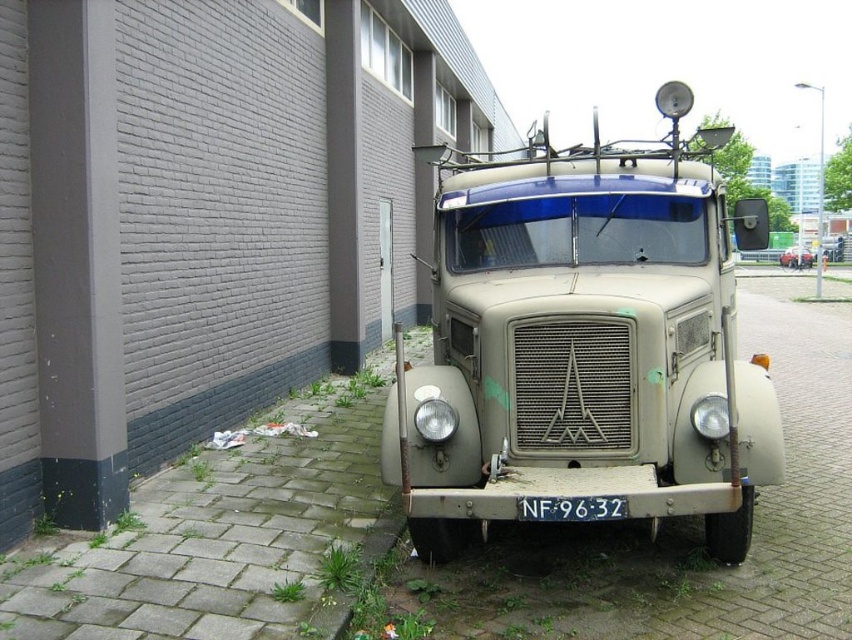
You are a delivery driver who needs to check the license plate of the matte beige truck at center. However, you notice that the black plastic license plate at center is obstructed. Based on the scene, can you determine if the license plate is visible from your current position in front of the truck?

The black plastic license plate at center is behind matte beige truck at center, so it is not visible from the front position.

You are standing at the origin point of a coordinate system where the image is mapped. The truck is at coordinates given. If you want to walk directly to the matte beige truck at center, in which direction should you move from your current position?

You should move towards the coordinates specified for the matte beige truck at center, which is located at point 0.536 on the x axis and 0.689 on the y axis. Since the origin is at (0, 0), moving in the positive x and positive y direction will lead you directly to the truck.